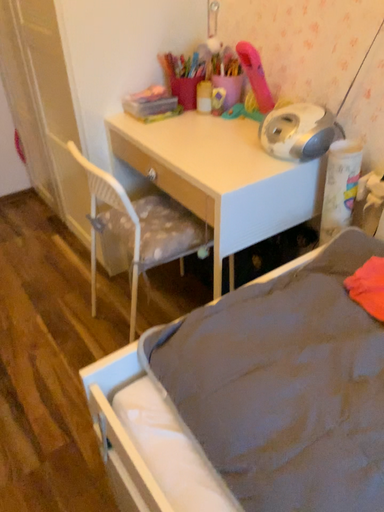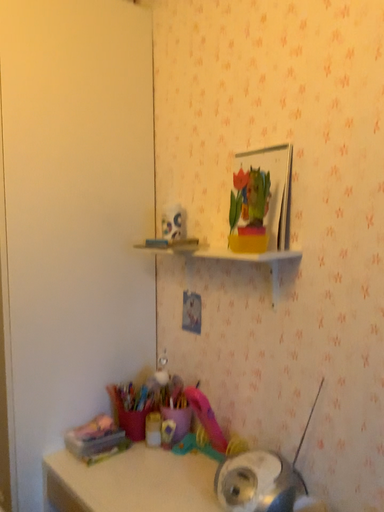
Question: Which way did the camera rotate in the video?

Choices:
 (A) rotated upward
 (B) rotated downward

Answer: (A)